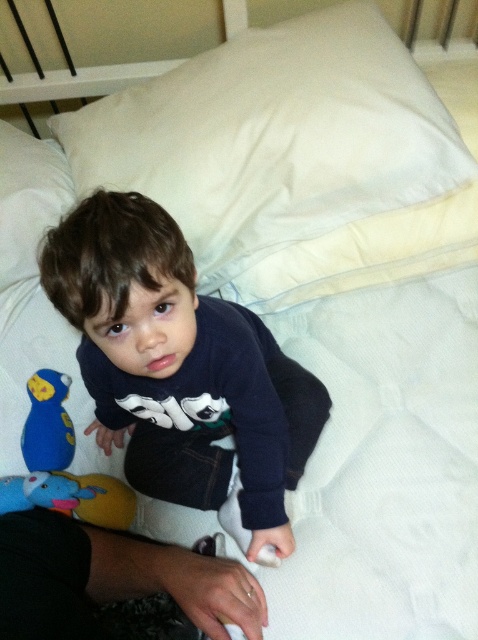
Who is positioned more to the left, dark blue sweater at center or blue plush toy at lower left?

blue plush toy at lower left

Between point (205, 305) and point (44, 420), which one is positioned behind?

Positioned behind is point (44, 420).

Measure the distance between dark blue sweater at center and camera.

dark blue sweater at center is 23.44 inches away from camera.

The height and width of the screenshot is (640, 478). What are the coordinates of `dark blue sweater at center` in the screenshot? It's located at (181, 369).

Is white soft pillow at upper left in front of blue plush toy at lower left?

No, it is behind blue plush toy at lower left.

Is white soft pillow at upper left to the left of blue plush toy at lower left from the viewer's perspective?

Correct, you'll find white soft pillow at upper left to the left of blue plush toy at lower left.

Find the location of a particular element. The width and height of the screenshot is (478, 640). white soft pillow at upper left is located at coordinates (29, 198).

From the picture: Which of these two, dark blue sweater at center or dark blue jeans at lower left, stands shorter?

Standing shorter between the two is dark blue jeans at lower left.

Is dark blue sweater at center thinner than dark blue jeans at lower left?

In fact, dark blue sweater at center might be wider than dark blue jeans at lower left.

Find the location of a particular element. dark blue sweater at center is located at coordinates (181, 369).

This screenshot has height=640, width=478. Identify the location of dark blue sweater at center. (181, 369).